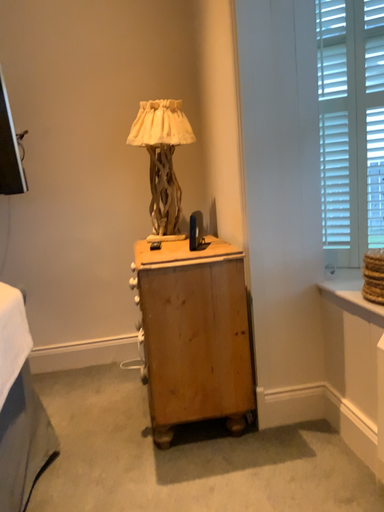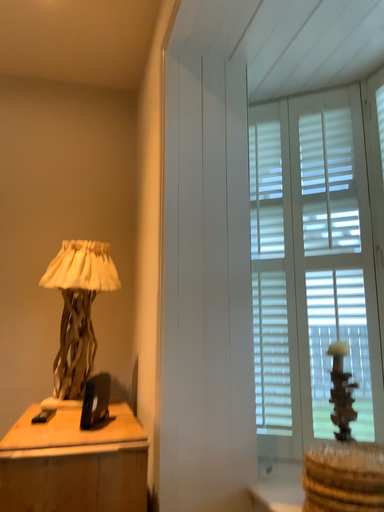
Question: Which way did the camera rotate in the video?

Choices:
 (A) rotated downward
 (B) rotated upward

Answer: (B)